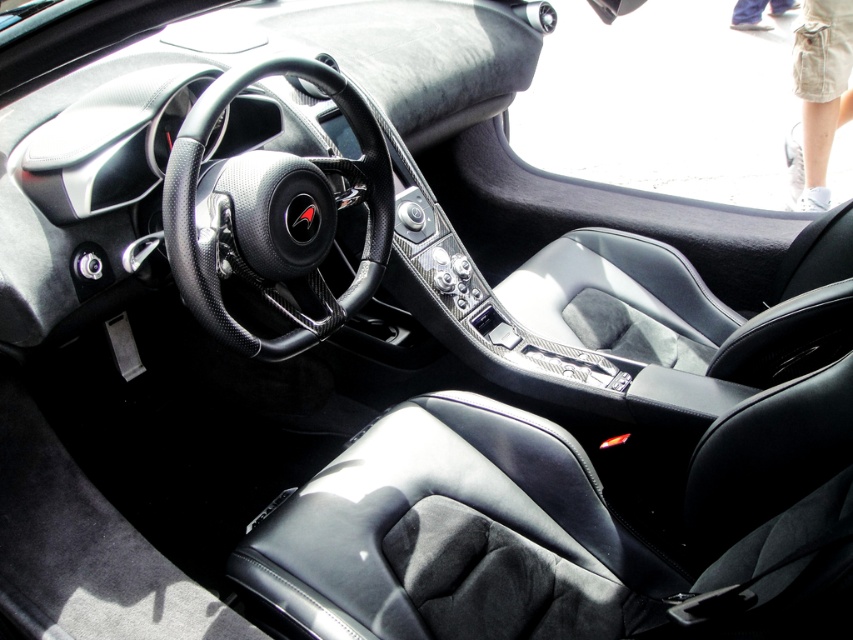
Question: Which point is closer to the camera?

Choices:
 (A) (376, 163)
 (B) (833, 125)

Answer: (A)

Question: Is carbon fiber steering wheel at center thinner than black leather seat at center?

Choices:
 (A) yes
 (B) no

Answer: (A)

Question: Is carbon fiber steering wheel at center wider than black leather seat at center?

Choices:
 (A) no
 (B) yes

Answer: (A)

Question: Which point is farther from the camera taking this photo?

Choices:
 (A) (811, 145)
 (B) (225, 339)

Answer: (A)

Question: Can you confirm if carbon fiber steering wheel at center is positioned to the left of black leather seat at center?

Choices:
 (A) yes
 (B) no

Answer: (A)